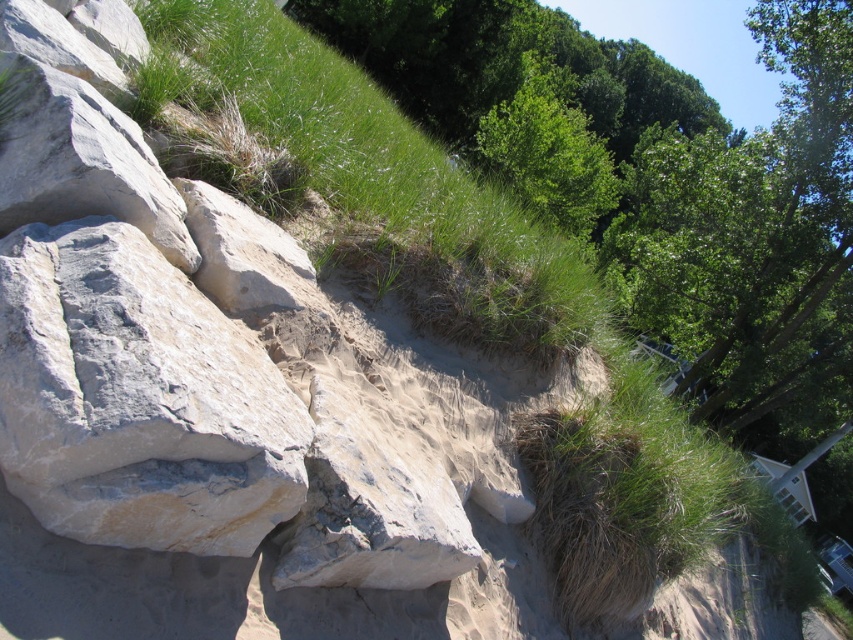
In the scene shown: Between beige/rough rock at left and green leafy tree at upper center, which one has less height?

Standing shorter between the two is beige/rough rock at left.

Describe the element at coordinates (137, 400) in the screenshot. I see `beige/rough rock at left` at that location.

Which is behind, point (74, 301) or point (558, 70)?

Positioned behind is point (558, 70).

At what (x,y) coordinates should I click in order to perform the action: click on beige/rough rock at left. Please return your answer as a coordinate pair (x, y). The height and width of the screenshot is (640, 853). Looking at the image, I should click on (137, 400).